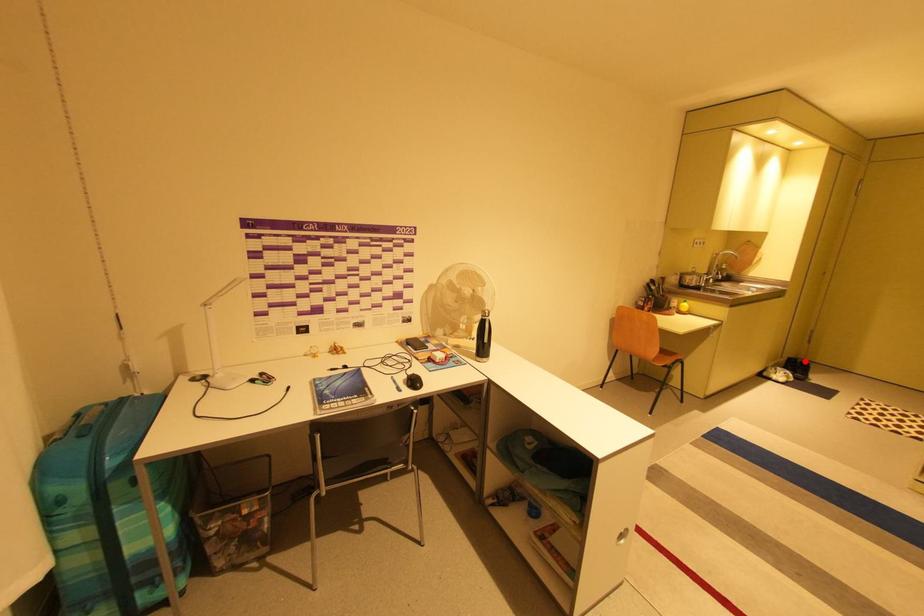
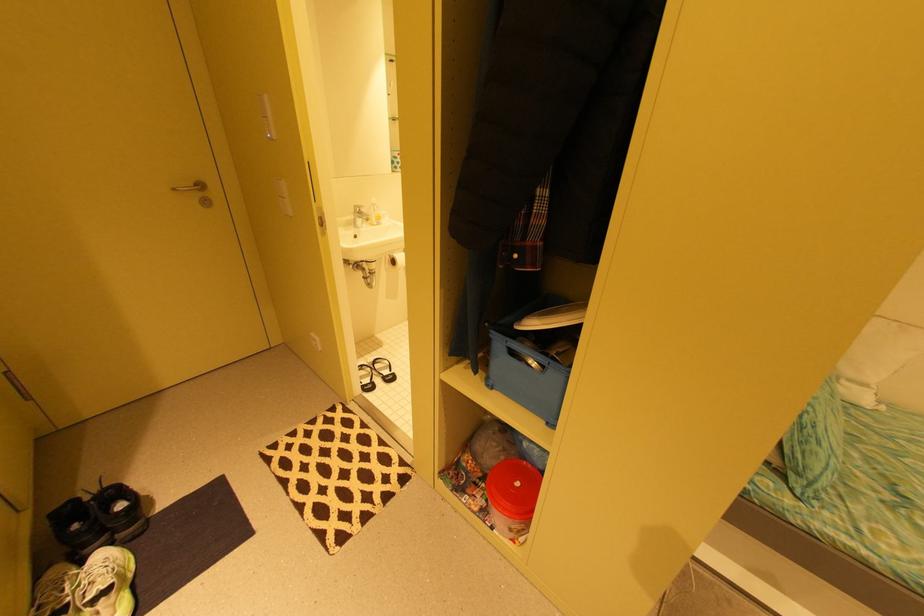
Question: I am providing you with two images of the same scene from different viewpoints. Image1 has a red point marked. In image2, the corresponding 3D location appears at what relative position? Reply with the corresponding letter.

Choices:
 (A) Closer
 (B) Farther

Answer: (A)